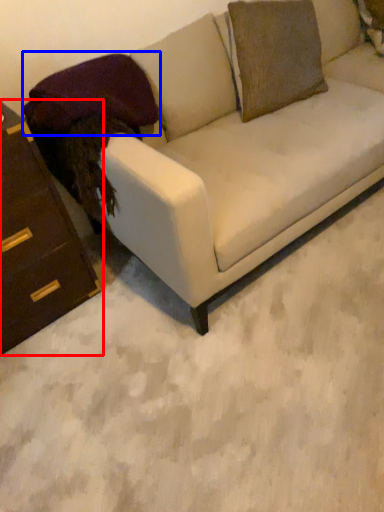
Question: Which object appears farthest to the camera in this image, chest of drawers (highlighted by a red box) or pillow (highlighted by a blue box)?

Choices:
 (A) chest of drawers
 (B) pillow

Answer: (B)